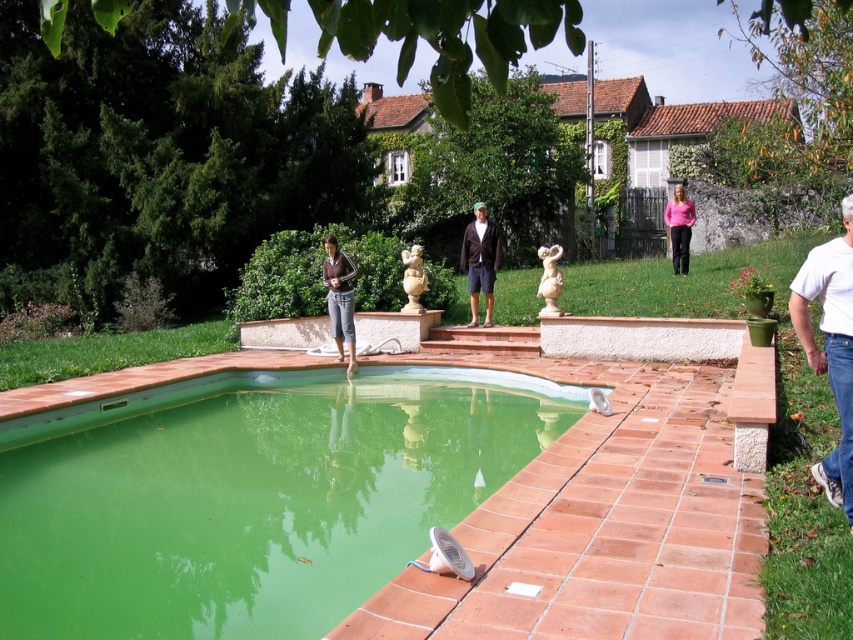
Is matte brown sweater at center thinner than pink fabric shirt at upper right?

No.

Is point (334, 243) in front of point (675, 257)?

Yes, it is.

Identify the location of matte brown sweater at center. (339, 298).

Does matte brown sweater at center appear on the right side of white marble statue at center?

In fact, matte brown sweater at center is to the left of white marble statue at center.

Is matte brown sweater at center thinner than white marble statue at center?

Incorrect, matte brown sweater at center's width is not less than white marble statue at center's.

Between point (335, 317) and point (555, 314), which one is positioned in front?

Point (335, 317)

Locate an element on the screen. This screenshot has height=640, width=853. matte brown sweater at center is located at coordinates (339, 298).

Can you confirm if green concrete pool at lower left is positioned below matte brown sweater at center?

Indeed, green concrete pool at lower left is positioned under matte brown sweater at center.

Does green concrete pool at lower left lie in front of matte brown sweater at center?

That is True.

The image size is (853, 640). Find the location of `green concrete pool at lower left`. green concrete pool at lower left is located at coordinates (251, 496).

Image resolution: width=853 pixels, height=640 pixels. I want to click on green concrete pool at lower left, so click(x=251, y=496).